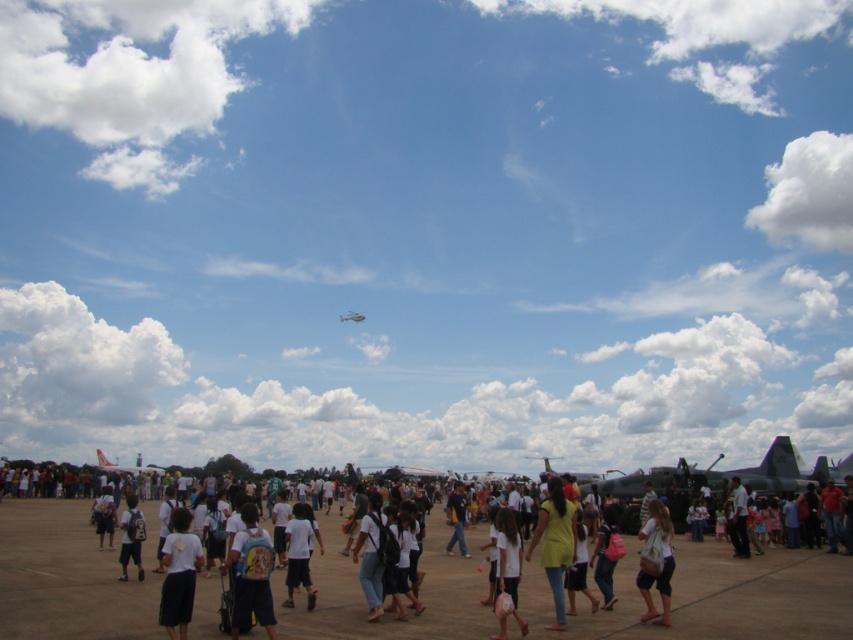
Which is more to the left, matte blue backpack at center or light brown fabric bag at lower right?

matte blue backpack at center

Which is above, matte blue backpack at center or light brown fabric bag at lower right?

matte blue backpack at center

Locate an element on the screen. The height and width of the screenshot is (640, 853). matte blue backpack at center is located at coordinates (250, 576).

Who is taller, dark blue shirt at center or metallic gray fighter jet at upper center?

dark blue shirt at center is taller.

Between dark blue shirt at center and metallic gray fighter jet at upper center, which one is positioned lower?

Positioned lower is dark blue shirt at center.

Where is `dark blue shirt at center`? This screenshot has width=853, height=640. dark blue shirt at center is located at coordinates (456, 518).

Between point (177, 579) and point (502, 518), which one is positioned in front?

Point (177, 579)

Is white matte skirt at lower center above white matte shirt at center?

Correct, white matte skirt at lower center is located above white matte shirt at center.

The height and width of the screenshot is (640, 853). Describe the element at coordinates (178, 573) in the screenshot. I see `white matte skirt at lower center` at that location.

Locate an element on the screen. The height and width of the screenshot is (640, 853). white matte skirt at lower center is located at coordinates (178, 573).